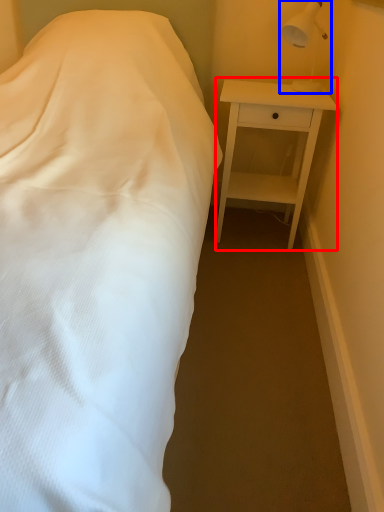
Question: Which of the following is the closest to the observer, nightstand (highlighted by a red box) or lamp (highlighted by a blue box)?

Choices:
 (A) nightstand
 (B) lamp

Answer: (B)